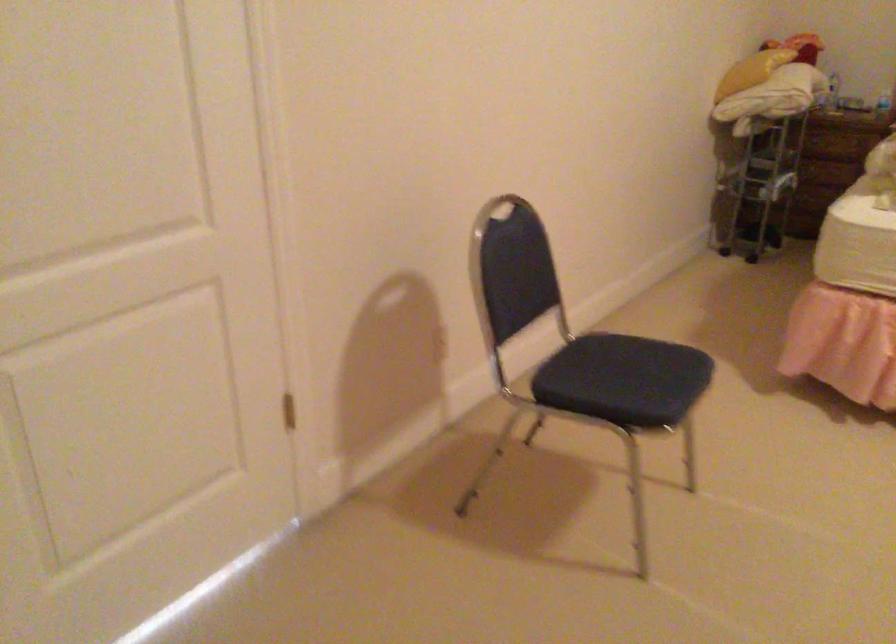
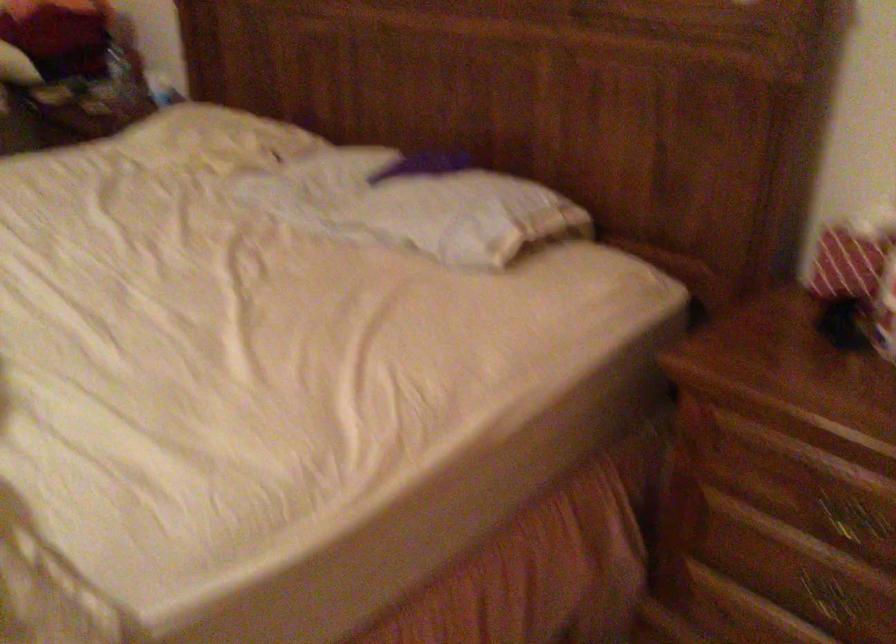
What movement of the cameraman would produce the second image?

The movement direction of the cameraman is right, forward.